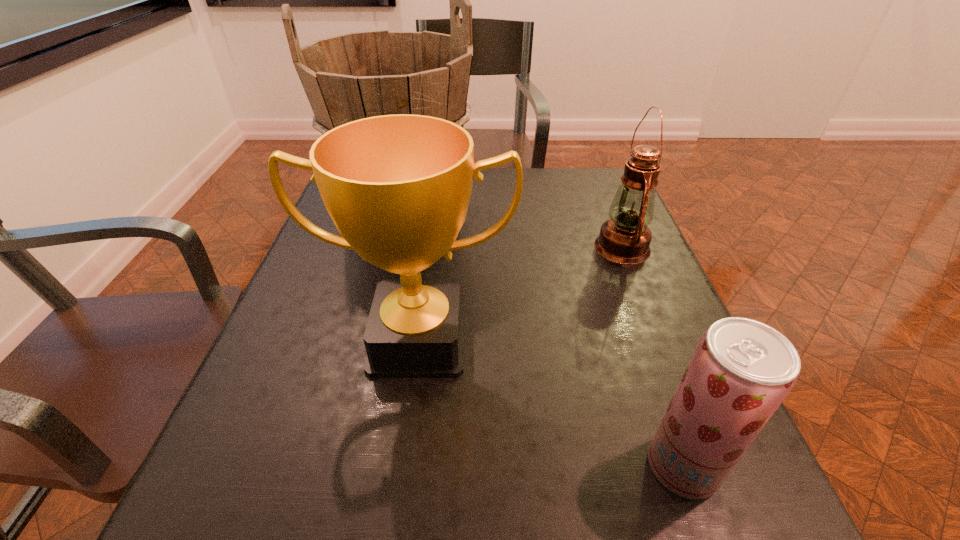
The width and height of the screenshot is (960, 540). In order to click on object that is the closest to the fruit juice in this screenshot , I will do `click(397, 187)`.

This screenshot has width=960, height=540. I want to click on object that stands as the second closest to the nearest object, so click(x=625, y=238).

Locate an element on the screen. The height and width of the screenshot is (540, 960). vacant point that satisfies the following two spatial constraints: 1. on the back side of the second shortest object; 2. on the left side of the nearest object is located at coordinates (605, 247).

Find the location of a particular element. This screenshot has height=540, width=960. vacant region that satisfies the following two spatial constraints: 1. on the front-facing side of the fruit juice; 2. on the left side of the third farthest object is located at coordinates (401, 466).